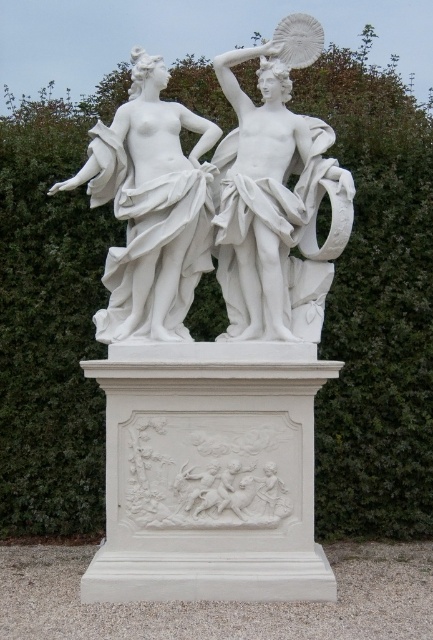
You are an art conservator assessing the space requirements for transporting two white marble statues. The statues are the white marble statue at center and the white marble statue at left. Which statue requires a smaller storage space?

The white marble statue at center requires a smaller storage space because it occupies less space than the white marble statue at left.